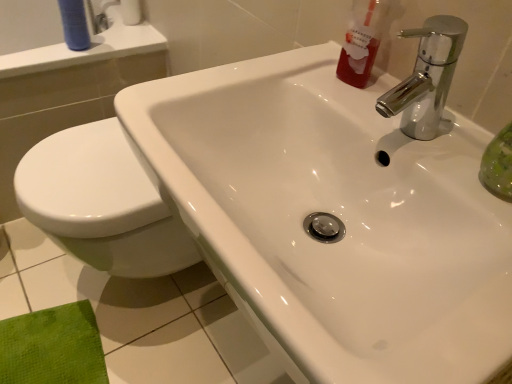
This screenshot has height=384, width=512. In order to click on blank space to the left of translucent red liquid at upper right in this screenshot , I will do `click(278, 77)`.